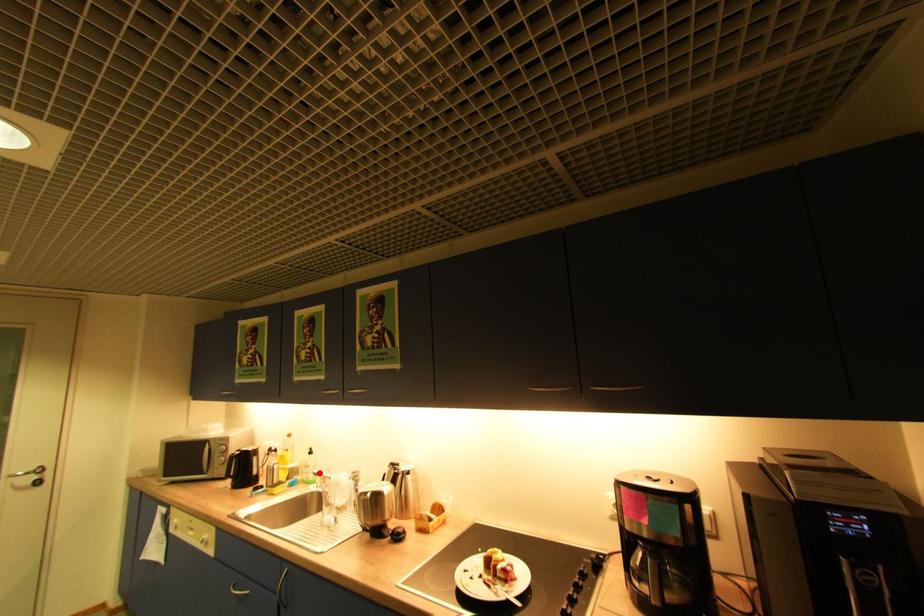
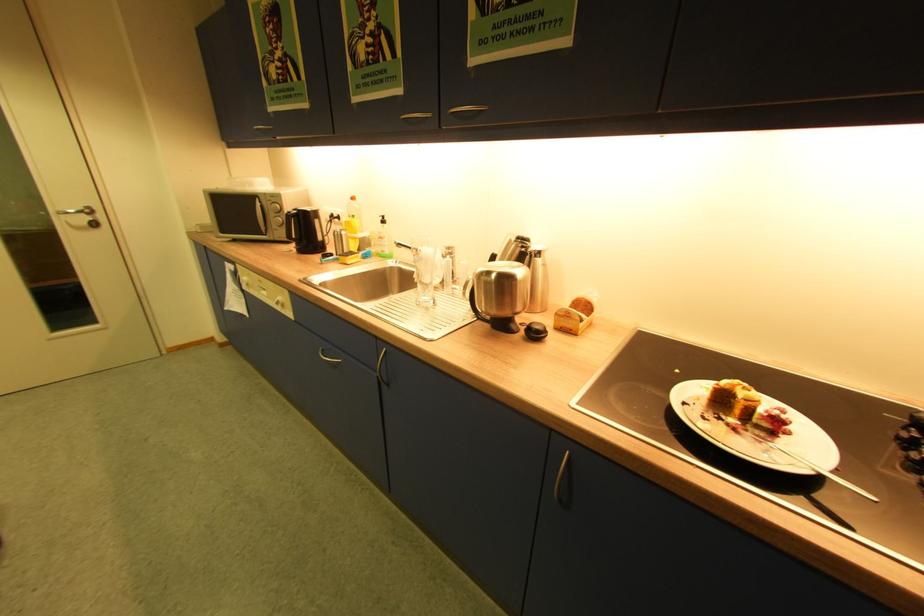
Question: I am providing you with two images of the same scene from different viewpoints. Image1 has a red point marked. In image2, the corresponding 3D location appears at what relative position? Reply with the corresponding letter.

Choices:
 (A) Closer
 (B) Farther

Answer: (A)